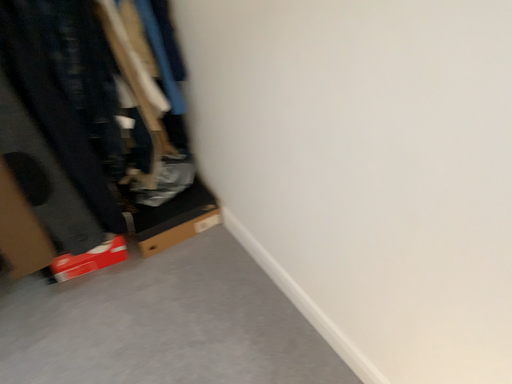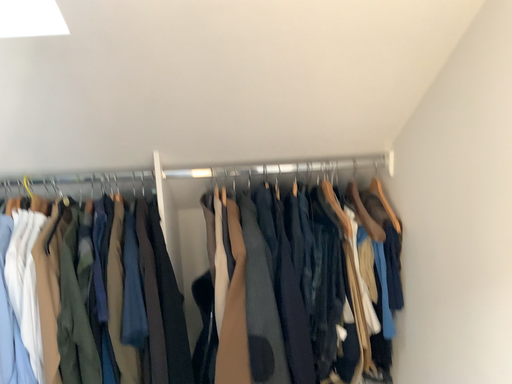
Question: How did the camera likely rotate when shooting the video?

Choices:
 (A) rotated left
 (B) rotated right

Answer: (A)